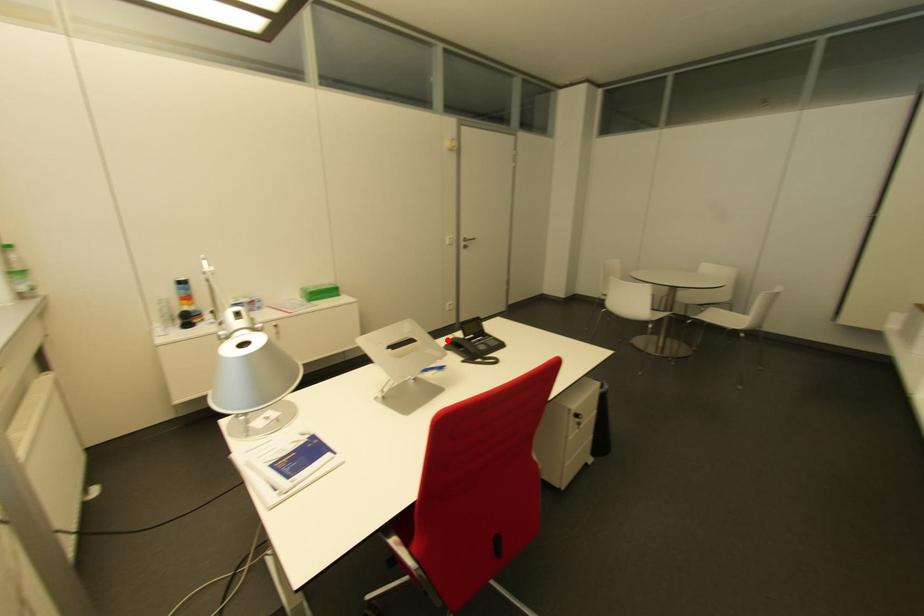
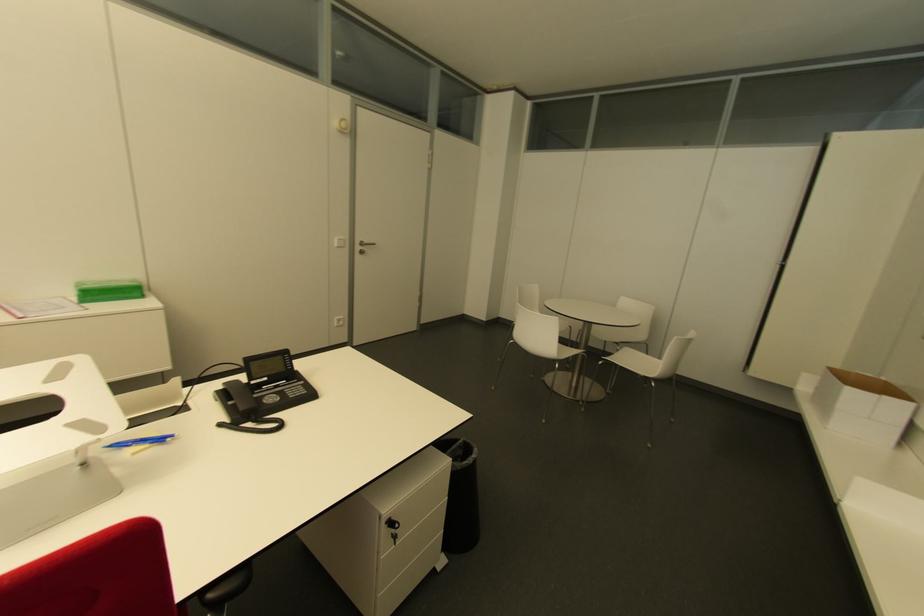
Question: I am providing you with two images of the same scene from different viewpoints. A red point is marked on the first image. Is the red point's position out of view in image 2?

Choices:
 (A) Yes
 (B) No

Answer: (B)